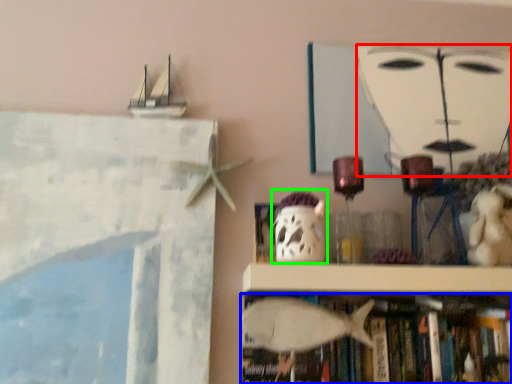
Question: Based on their relative distances, which object is nearer to human face (highlighted by a red box)? Choose from book (highlighted by a blue box) and ghost (highlighted by a green box).

Choices:
 (A) book
 (B) ghost

Answer: (B)